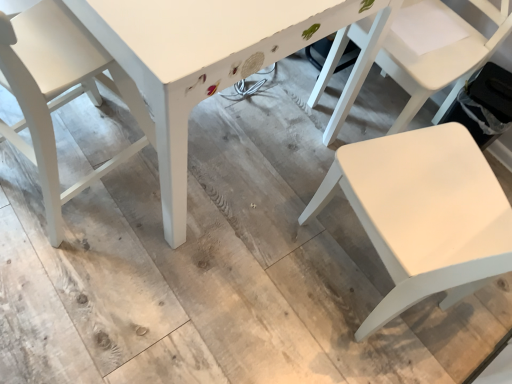
At what (x,y) coordinates should I click in order to perform the action: click on white matte chair at left, acting as the third chair starting from the right. Please return your answer as a coordinate pair (x, y). This screenshot has height=384, width=512. Looking at the image, I should click on (58, 92).

Where is `white matte chair at lower right, the 2th chair viewed from the right`? white matte chair at lower right, the 2th chair viewed from the right is located at coordinates (423, 214).

The width and height of the screenshot is (512, 384). What do you see at coordinates (411, 54) in the screenshot? I see `white matte chair at right, the 3th chair in the left-to-right sequence` at bounding box center [411, 54].

This screenshot has width=512, height=384. I want to click on white matte chair at left, acting as the third chair starting from the right, so click(58, 92).

Find the location of a particular element. chair that is the 2nd one when counting backward from the white matte chair at lower right, which is the 2th chair from left to right is located at coordinates (411, 54).

Which of these two, white matte chair at lower right, which is the 2th chair from left to right, or white matte chair at right, the 3th chair in the left-to-right sequence, stands shorter?

white matte chair at right, the 3th chair in the left-to-right sequence.

From a real-world perspective, is white matte chair at lower right, which is the 2th chair from left to right, over white matte chair at right, placed as the 1th chair when sorted from right to left?

Yes, from a real-world perspective, white matte chair at lower right, which is the 2th chair from left to right, is above white matte chair at right, placed as the 1th chair when sorted from right to left.

Measure the distance between white painted wood table at center and white matte chair at right, placed as the 1th chair when sorted from right to left.

white painted wood table at center is 14.78 inches away from white matte chair at right, placed as the 1th chair when sorted from right to left.

Which object is further away from the camera taking this photo, white painted wood table at center or white matte chair at right, the 3th chair in the left-to-right sequence?

white matte chair at right, the 3th chair in the left-to-right sequence, is further away from the camera.

Is point (393, 2) positioned before point (434, 38)?

Yes, it is in front of point (434, 38).

Considering the sizes of objects white painted wood table at center and white matte chair at right, placed as the 1th chair when sorted from right to left, in the image provided, who is smaller, white painted wood table at center or white matte chair at right, placed as the 1th chair when sorted from right to left,?

Smaller between the two is white matte chair at right, placed as the 1th chair when sorted from right to left.

From the image's perspective, is white matte chair at right, the 3th chair in the left-to-right sequence, located above white matte chair at left, which is counted as the 1th chair, starting from the left?

Correct, white matte chair at right, the 3th chair in the left-to-right sequence, appears higher than white matte chair at left, which is counted as the 1th chair, starting from the left, in the image.

Can you tell me how much white matte chair at right, placed as the 1th chair when sorted from right to left, and white matte chair at left, acting as the third chair starting from the right, differ in facing direction?

168 degrees.

Which of these two, white matte chair at right, placed as the 1th chair when sorted from right to left, or white matte chair at left, which is counted as the 1th chair, starting from the left, is smaller?

white matte chair at left, which is counted as the 1th chair, starting from the left.

Does white matte chair at left, acting as the third chair starting from the right, appear on the right side of white matte chair at lower right, which is the 2th chair from left to right?

No.

From the picture: Is white matte chair at left, acting as the third chair starting from the right, facing towards white matte chair at lower right, the 2th chair viewed from the right?

No, white matte chair at left, acting as the third chair starting from the right, does not turn towards white matte chair at lower right, the 2th chair viewed from the right.

Is point (68, 67) closer to camera compared to point (445, 136)?

That is True.

Could you measure the distance between white matte chair at left, which is counted as the 1th chair, starting from the left, and white matte chair at lower right, which is the 2th chair from left to right?

31.62 inches.

From a real-world perspective, is white painted wood table at center positioned above or below white matte chair at left, acting as the third chair starting from the right?

white painted wood table at center is below white matte chair at left, acting as the third chair starting from the right.

From the image's perspective, is white painted wood table at center located above white matte chair at left, acting as the third chair starting from the right?

Yes.

Is white painted wood table at center wider or thinner than white matte chair at left, acting as the third chair starting from the right?

Clearly, white painted wood table at center has more width compared to white matte chair at left, acting as the third chair starting from the right.

Between point (162, 216) and point (0, 65), which one is positioned in front?

The point (0, 65) is closer to the camera.

Is white painted wood table at center shorter than white matte chair at lower right, the 2th chair viewed from the right?

Yes.

Considering the relative sizes of white painted wood table at center and white matte chair at lower right, which is the 2th chair from left to right, in the image provided, is white painted wood table at center wider than white matte chair at lower right, which is the 2th chair from left to right,?

Correct, the width of white painted wood table at center exceeds that of white matte chair at lower right, which is the 2th chair from left to right.

Where is `table that appears on the left of white matte chair at lower right, which is the 2th chair from left to right`? The height and width of the screenshot is (384, 512). table that appears on the left of white matte chair at lower right, which is the 2th chair from left to right is located at coordinates (204, 60).

How far apart are white matte chair at right, placed as the 1th chair when sorted from right to left, and white painted wood table at center?

A distance of 14.78 inches exists between white matte chair at right, placed as the 1th chair when sorted from right to left, and white painted wood table at center.

From their relative heights in the image, would you say white matte chair at right, the 3th chair in the left-to-right sequence, is taller or shorter than white painted wood table at center?

Clearly, white matte chair at right, the 3th chair in the left-to-right sequence, is shorter compared to white painted wood table at center.

Is white matte chair at right, placed as the 1th chair when sorted from right to left, aimed at white painted wood table at center?

Yes, white matte chair at right, placed as the 1th chair when sorted from right to left, is facing white painted wood table at center.

From a real-world perspective, who is located lower, white matte chair at right, the 3th chair in the left-to-right sequence, or white painted wood table at center?

In real-world perspective, white matte chair at right, the 3th chair in the left-to-right sequence, is lower.

This screenshot has height=384, width=512. I want to click on chair on the right of white matte chair at lower right, which is the 2th chair from left to right, so click(x=411, y=54).

Find the location of a particular element. This screenshot has width=512, height=384. chair behind the white painted wood table at center is located at coordinates (411, 54).

Considering their positions, is white matte chair at left, acting as the third chair starting from the right, positioned closer to white painted wood table at center than white matte chair at lower right, the 2th chair viewed from the right?

white matte chair at left, acting as the third chair starting from the right, is closer to white painted wood table at center.

When comparing their distances from white painted wood table at center, does white matte chair at lower right, the 2th chair viewed from the right, or white matte chair at left, acting as the third chair starting from the right, seem closer?

white matte chair at left, acting as the third chair starting from the right.

When comparing their distances from white painted wood table at center, does white matte chair at left, acting as the third chair starting from the right, or white matte chair at right, placed as the 1th chair when sorted from right to left, seem further?

white matte chair at right, placed as the 1th chair when sorted from right to left, lies further to white painted wood table at center than the other object.

From the image, which object appears to be nearer to white painted wood table at center, white matte chair at lower right, the 2th chair viewed from the right, or white matte chair at right, the 3th chair in the left-to-right sequence?

white matte chair at right, the 3th chair in the left-to-right sequence.

Looking at the image, which one is located closer to white matte chair at right, placed as the 1th chair when sorted from right to left, white matte chair at left, acting as the third chair starting from the right, or white painted wood table at center?

Among the two, white painted wood table at center is located nearer to white matte chair at right, placed as the 1th chair when sorted from right to left.

Looking at the image, which one is located further to white matte chair at lower right, which is the 2th chair from left to right, white matte chair at right, placed as the 1th chair when sorted from right to left, or white matte chair at left, which is counted as the 1th chair, starting from the left?

white matte chair at left, which is counted as the 1th chair, starting from the left, is further to white matte chair at lower right, which is the 2th chair from left to right.

Considering their positions, is white matte chair at right, placed as the 1th chair when sorted from right to left, positioned closer to white matte chair at left, which is counted as the 1th chair, starting from the left, than white painted wood table at center?

Based on the image, white painted wood table at center appears to be nearer to white matte chair at left, which is counted as the 1th chair, starting from the left.

When comparing their distances from white matte chair at left, which is counted as the 1th chair, starting from the left, does white painted wood table at center or white matte chair at right, placed as the 1th chair when sorted from right to left, seem closer?

The object closer to white matte chair at left, which is counted as the 1th chair, starting from the left, is white painted wood table at center.

The image size is (512, 384). I want to click on table between white matte chair at left, acting as the third chair starting from the right, and white matte chair at right, the 3th chair in the left-to-right sequence, so click(x=204, y=60).

This screenshot has width=512, height=384. Find the location of `chair between white matte chair at left, which is counted as the 1th chair, starting from the left, and white matte chair at right, the 3th chair in the left-to-right sequence, from left to right`. chair between white matte chair at left, which is counted as the 1th chair, starting from the left, and white matte chair at right, the 3th chair in the left-to-right sequence, from left to right is located at coordinates (423, 214).

The width and height of the screenshot is (512, 384). Identify the location of table between white matte chair at left, which is counted as the 1th chair, starting from the left, and white matte chair at lower right, the 2th chair viewed from the right, from left to right. (204, 60).

Identify the location of chair between white painted wood table at center and white matte chair at right, the 3th chair in the left-to-right sequence. coord(423,214).